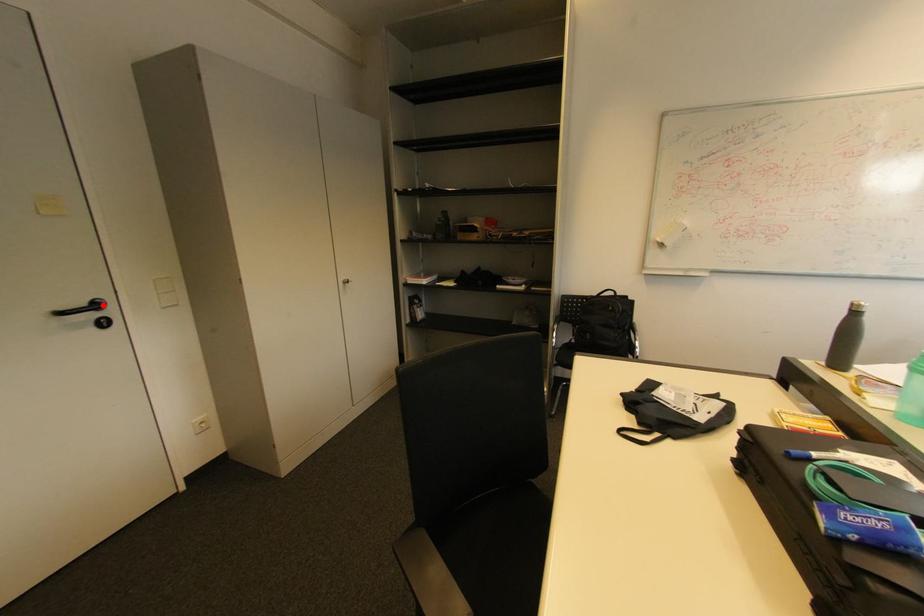
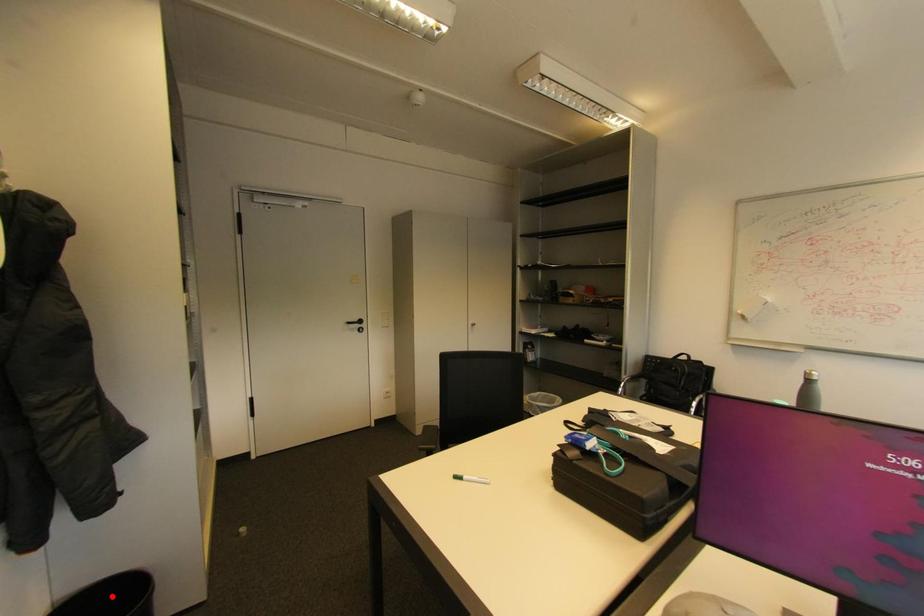
I am providing you with two images of the same scene from different viewpoints. A red point is marked on the first image and another point is marked on the second image. Is the red point in image1 aligned with the point shown in image2?

No